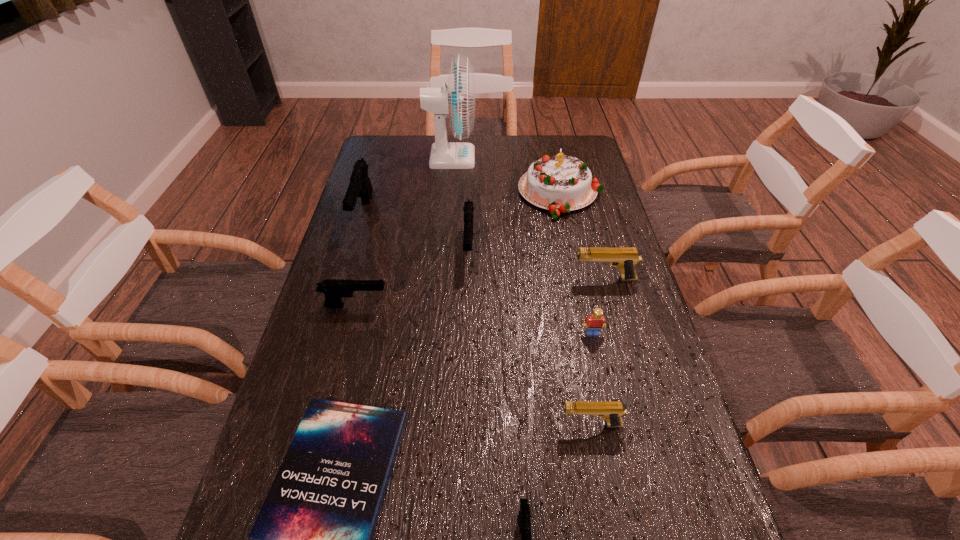
Locate which pistol ranks third in proximity to the second nearest pistol. Please provide its 2D coordinates. Your answer should be formatted as a tuple, i.e. [(x, y)], where the tuple contains the x and y coordinates of a point satisfying the conditions above.

[(468, 208)]

I want to click on pistol that can be found as the closest to the seventh farthest object, so click(x=625, y=258).

Locate which black pistol is the third closest to the biggest black pistol. Please provide its 2D coordinates. Your answer should be formatted as a tuple, i.e. [(x, y)], where the tuple contains the x and y coordinates of a point satisfying the conditions above.

[(524, 514)]

The image size is (960, 540). I want to click on the third closest black pistol to the white fan, so click(x=334, y=289).

At what (x,y) coordinates should I click in order to perform the action: click on free location that satisfies the following two spatial constraints: 1. on the front-facing side of the second black pistol from right to left; 2. on the front-facing side of the third nearest pistol. Please return your answer as a coordinate pair (x, y). Looking at the image, I should click on tap(468, 306).